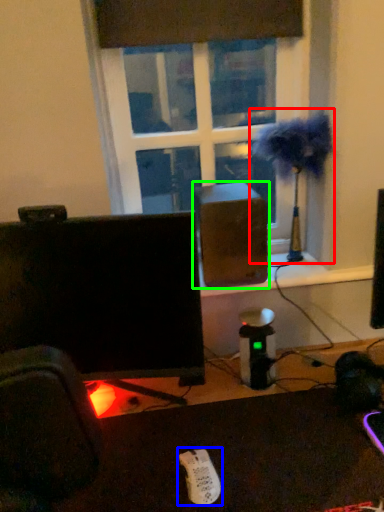
Question: Which object is the farthest from table lamp (highlighted by a red box)? Choose among these: Wii controller (highlighted by a blue box) or speaker (highlighted by a green box).

Choices:
 (A) Wii controller
 (B) speaker

Answer: (A)